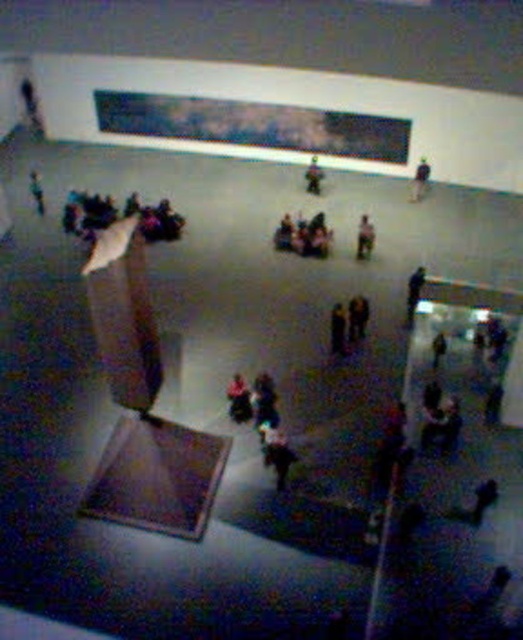
Between dark gray fabric jacket at center and matte black statue at upper left, which one has less height?

Standing shorter between the two is dark gray fabric jacket at center.

I want to click on dark gray fabric jacket at center, so click(x=313, y=177).

The image size is (523, 640). Describe the element at coordinates (313, 177) in the screenshot. I see `dark gray fabric jacket at center` at that location.

The width and height of the screenshot is (523, 640). I want to click on dark gray fabric jacket at center, so click(x=313, y=177).

Does dark brown leather jacket at center have a greater width compared to smooth brown coat at center?

Indeed, dark brown leather jacket at center has a greater width compared to smooth brown coat at center.

Who is more distant from viewer, (358, 326) or (344, 320)?

The point (358, 326) is behind.

Where is `dark brown leather jacket at center`? dark brown leather jacket at center is located at coordinates (358, 317).

Who is positioned more to the right, wooden statue at center or matte black statue at upper left?

From the viewer's perspective, wooden statue at center appears more on the right side.

Consider the image. Does wooden statue at center have a lesser width compared to matte black statue at upper left?

Correct, wooden statue at center's width is less than matte black statue at upper left's.

The width and height of the screenshot is (523, 640). Describe the element at coordinates (365, 237) in the screenshot. I see `wooden statue at center` at that location.

Identify the location of wooden statue at center. The height and width of the screenshot is (640, 523). (365, 237).